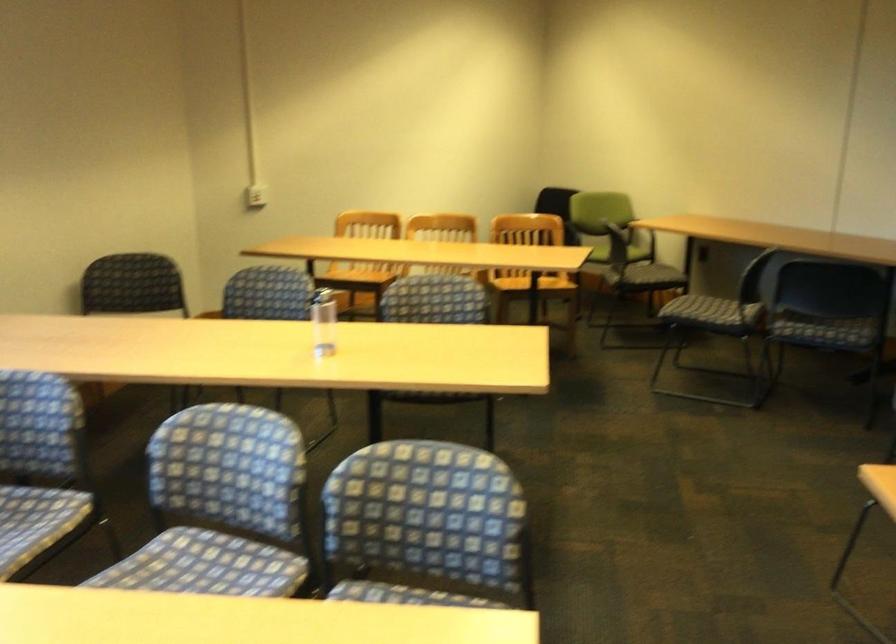
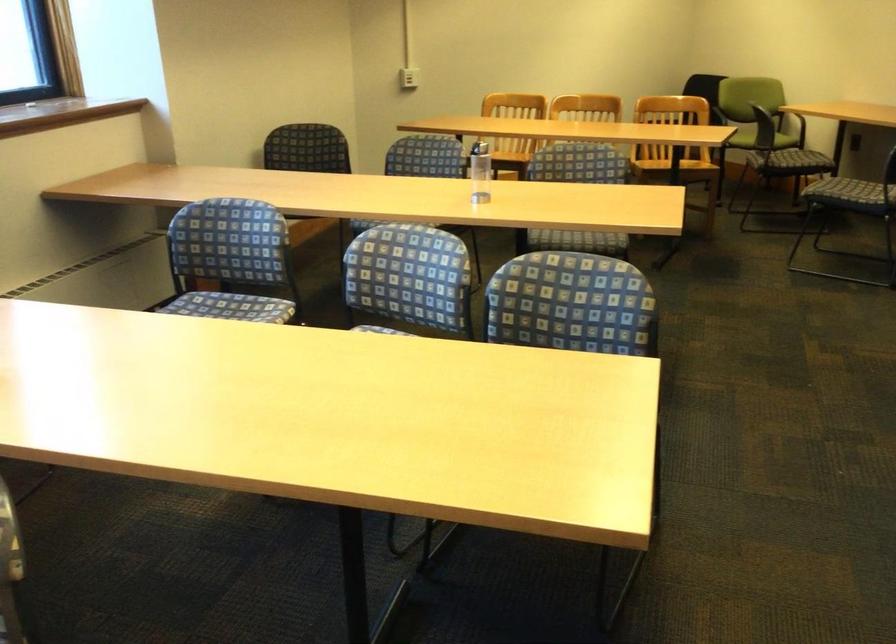
Question: What movement of the cameraman would produce the second image?

Choices:
 (A) Left
 (B) Right
 (C) Forward
 (D) Backward

Answer: (D)